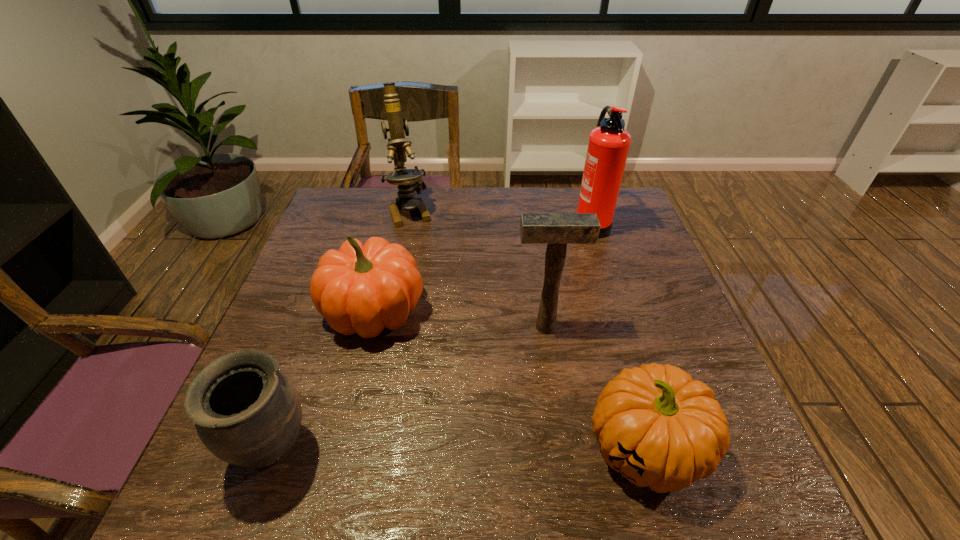
This screenshot has width=960, height=540. I want to click on vacant region located 0.110m at the nozzle of the fire extinguisher, so click(536, 223).

The width and height of the screenshot is (960, 540). Find the location of `vacant space located on the right of the microscope`. vacant space located on the right of the microscope is located at coordinates (476, 211).

Locate an element on the screen. vacant point located 0.160m on the left of the third tallest object is located at coordinates (445, 327).

You are a GUI agent. You are given a task and a screenshot of the screen. Output one action in this format:
    pyautogui.click(x=<x>, y=<y>)
    Task: Click on the vacant region located 0.080m on the left of the farther pumpkin
    
    Given the screenshot: What is the action you would take?
    pyautogui.click(x=291, y=311)

The image size is (960, 540). I want to click on vacant space situated 0.260m on the back of the urn, so click(x=323, y=316).

Where is `vacant point located on the surface of the right pumpkin`? The height and width of the screenshot is (540, 960). vacant point located on the surface of the right pumpkin is located at coordinates (515, 449).

Where is `vacant space located on the surface of the right pumpkin`? vacant space located on the surface of the right pumpkin is located at coordinates (439, 449).

Locate an element on the screen. The height and width of the screenshot is (540, 960). vacant space located 0.340m on the surface of the right pumpkin is located at coordinates (400, 449).

The width and height of the screenshot is (960, 540). In order to click on fire extinguisher that is at the far edge in this screenshot , I will do `click(608, 146)`.

You are a GUI agent. You are given a task and a screenshot of the screen. Output one action in this format:
    pyautogui.click(x=<x>, y=<y>)
    Task: Click on the microscope positioned at the far edge
    The height and width of the screenshot is (540, 960).
    Given the screenshot: What is the action you would take?
    pyautogui.click(x=409, y=182)